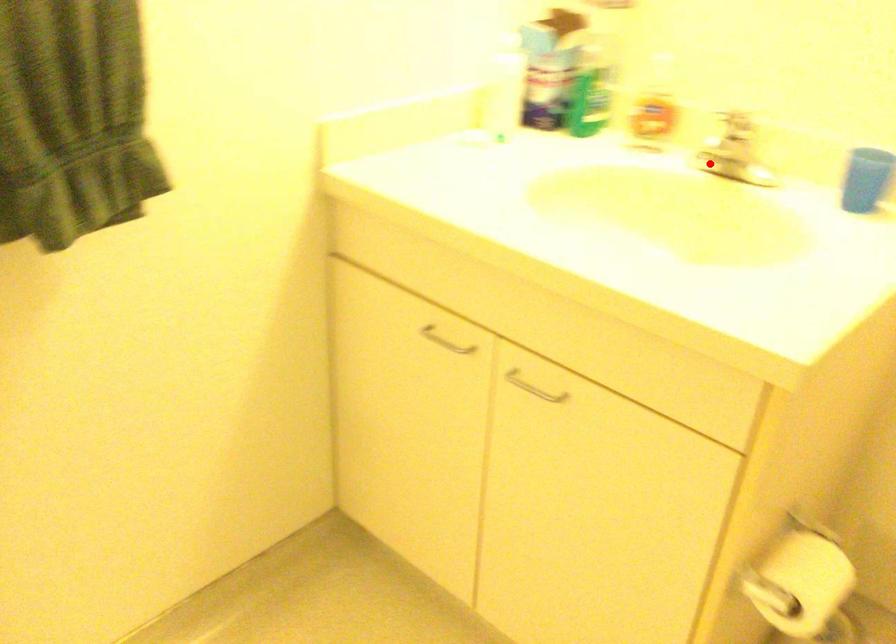
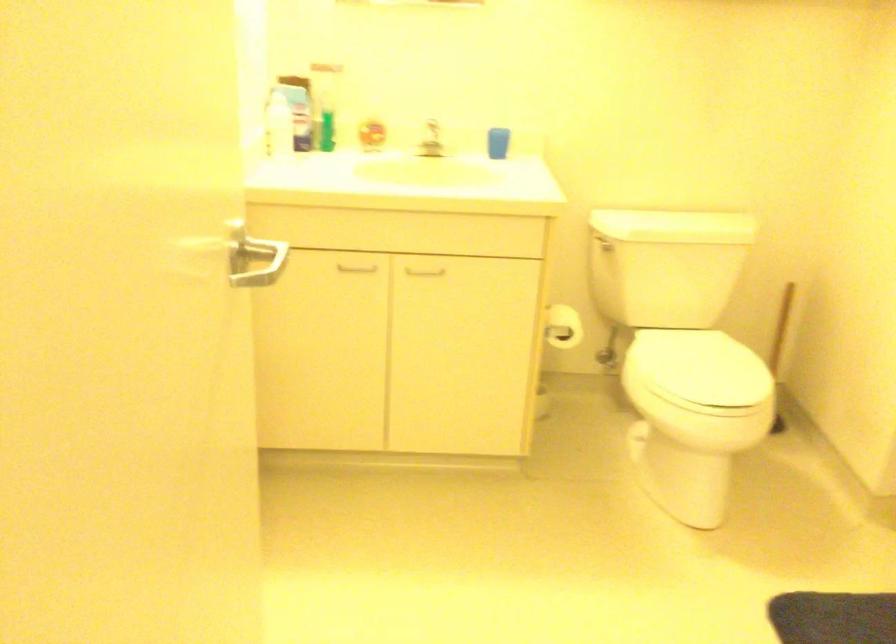
Find the pixel in the second image that matches the highlighted location in the first image.

(431, 140)